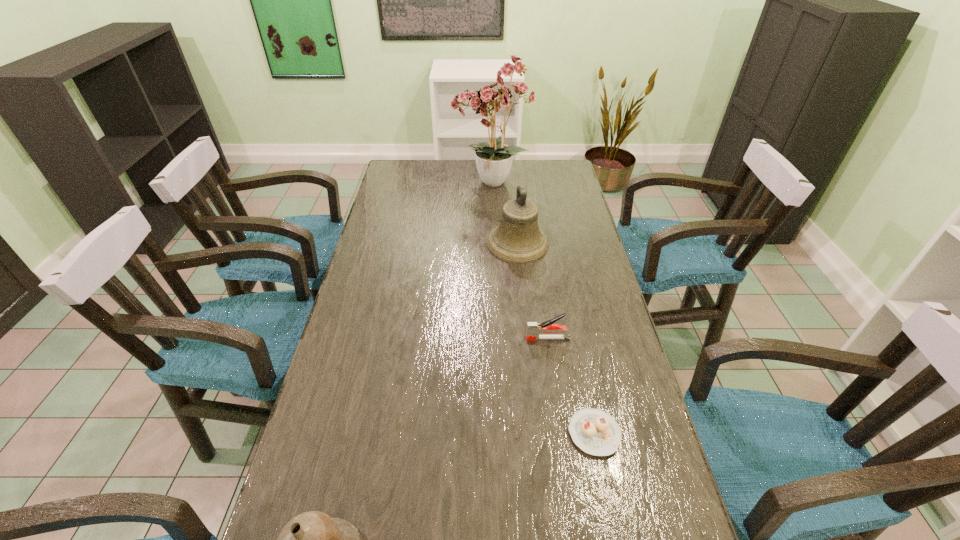
In order to click on free spot located on the front-facing side of the flower arrangement in this screenshot , I will do `click(426, 184)`.

The height and width of the screenshot is (540, 960). Find the location of `vacant point located on the back of the second tallest object`. vacant point located on the back of the second tallest object is located at coordinates (513, 195).

The width and height of the screenshot is (960, 540). In order to click on free location located 0.270m on the handle side of the stapler in this screenshot , I will do `click(428, 339)`.

This screenshot has height=540, width=960. Identify the location of free region located 0.080m on the handle side of the stapler. click(x=497, y=339).

Locate an element on the screen. The width and height of the screenshot is (960, 540). vacant region located 0.170m on the handle side of the stapler is located at coordinates (465, 339).

Where is `vacant space located 0.300m on the back of the second nearest object`? The width and height of the screenshot is (960, 540). vacant space located 0.300m on the back of the second nearest object is located at coordinates (570, 318).

Locate an element on the screen. object located in the far edge section of the desktop is located at coordinates (493, 101).

You are a GUI agent. You are given a task and a screenshot of the screen. Output one action in this format:
    pyautogui.click(x=<x>, y=<y>)
    Task: Click on the bell at the right edge
    The image size is (960, 540).
    Given the screenshot: What is the action you would take?
    pyautogui.click(x=518, y=239)

You are a GUI agent. You are given a task and a screenshot of the screen. Output one action in this format:
    pyautogui.click(x=<x>, y=<y>)
    Task: Click on the stapler located at the right edge
    
    Given the screenshot: What is the action you would take?
    pyautogui.click(x=534, y=329)

At what (x,y) coordinates should I click in order to perform the action: click on cupcake present at the right edge. Please return your answer as a coordinate pair (x, y). The width and height of the screenshot is (960, 540). Looking at the image, I should click on (595, 432).